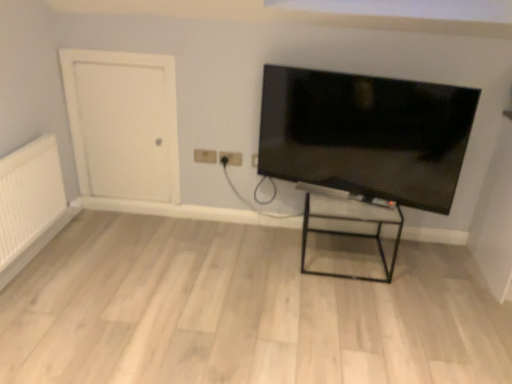
Where is `free spot above white matte door at left (from a real-world perspective)`? This screenshot has width=512, height=384. free spot above white matte door at left (from a real-world perspective) is located at coordinates (118, 49).